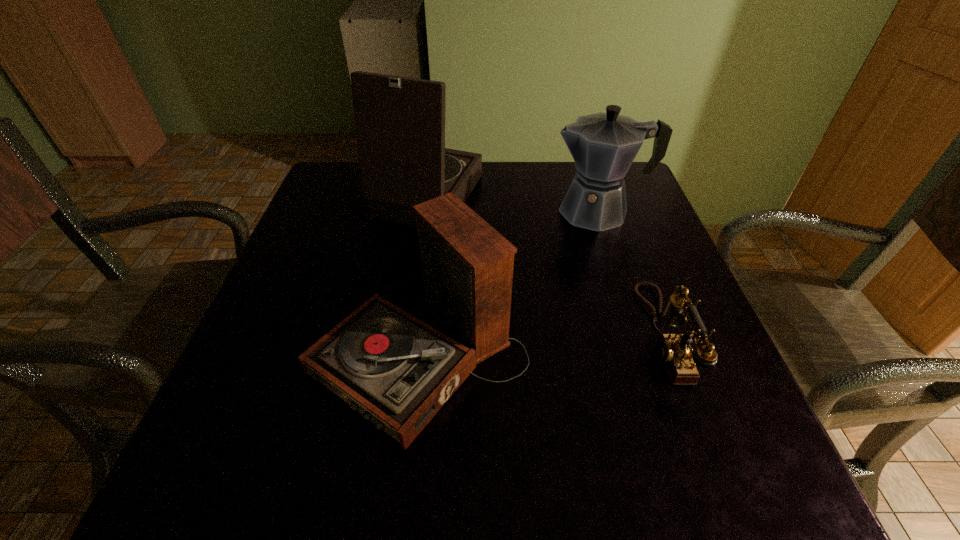
Where is `the tallest object`? the tallest object is located at coordinates (400, 122).

Find the location of a particular element. the taller phonograph record is located at coordinates click(400, 122).

Locate an element on the screen. Image resolution: width=960 pixels, height=540 pixels. coffeepot is located at coordinates (603, 145).

Locate an element on the screen. the nearer phonograph record is located at coordinates (397, 371).

Find the location of a particular element. This screenshot has height=540, width=960. the shorter phonograph record is located at coordinates (397, 371).

In order to click on the shortest object in this screenshot , I will do 674,351.

Where is `free space located on the right of the farther phonograph record`? free space located on the right of the farther phonograph record is located at coordinates (518, 197).

The width and height of the screenshot is (960, 540). What are the coordinates of `vacant area situated at the spout of the coffeepot` in the screenshot? It's located at (433, 211).

You are a GUI agent. You are given a task and a screenshot of the screen. Output one action in this format:
    pyautogui.click(x=<x>, y=<y>)
    Task: Click on the free space located at the spout of the coffeepot
    Image resolution: width=960 pixels, height=540 pixels.
    Given the screenshot: What is the action you would take?
    pyautogui.click(x=442, y=211)

You are a GUI agent. You are given a task and a screenshot of the screen. Output one action in this format:
    pyautogui.click(x=<x>, y=<y>)
    Task: Click on the vacant area situated at the spout of the coffeepot
    
    Given the screenshot: What is the action you would take?
    pyautogui.click(x=525, y=211)